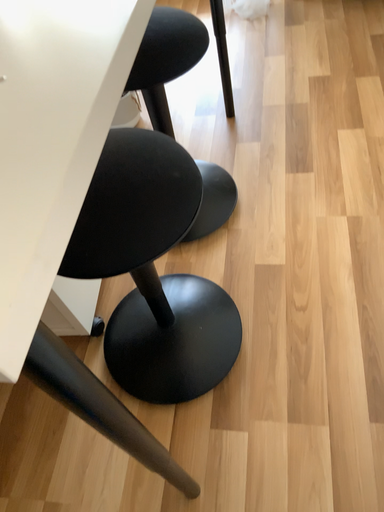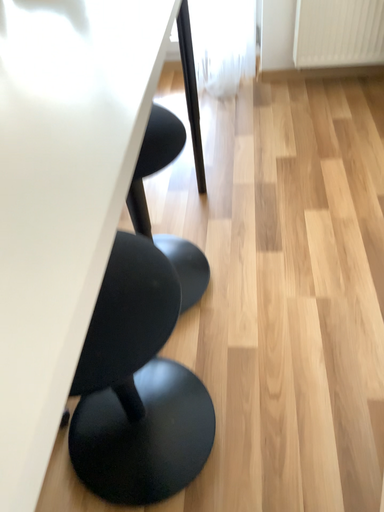
Question: Which way did the camera rotate in the video?

Choices:
 (A) rotated upward
 (B) rotated downward

Answer: (A)